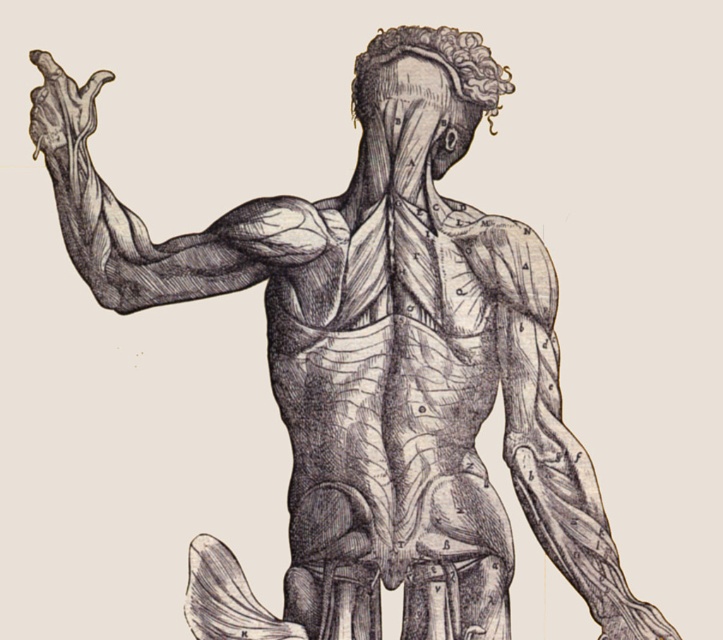
Measure the distance between smooth black arm at upper left and smooth skin hand at upper left.

27.83 inches

How distant is smooth black arm at upper left from smooth skin hand at upper left?

smooth black arm at upper left is 27.83 inches from smooth skin hand at upper left.

Locate an element on the screen. This screenshot has height=640, width=723. smooth black arm at upper left is located at coordinates (145, 227).

Locate an element on the screen. smooth black arm at upper left is located at coordinates (145, 227).